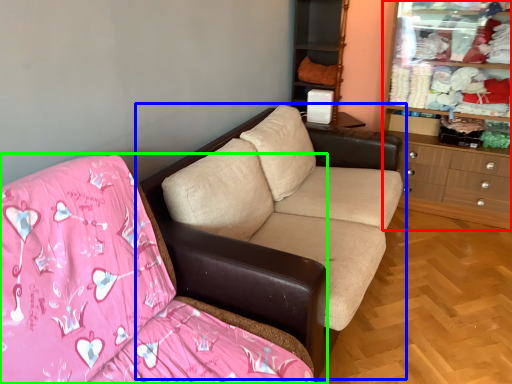
Question: Considering the real-world distances, which object is closest to dresser (highlighted by a red box)? studio couch (highlighted by a blue box) or studio couch (highlighted by a green box).

Choices:
 (A) studio couch
 (B) studio couch

Answer: (A)